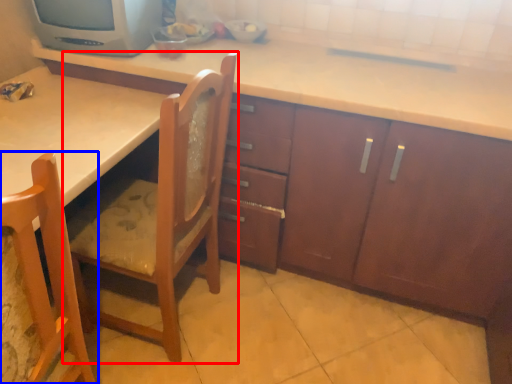
Question: Which of the following is the closest to the observer, chair (highlighted by a red box) or chair (highlighted by a blue box)?

Choices:
 (A) chair
 (B) chair

Answer: (B)